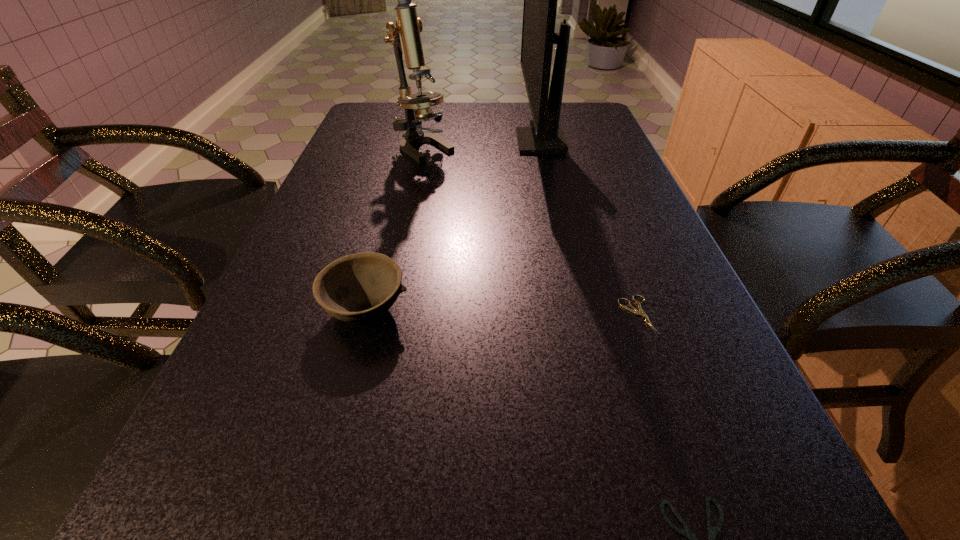
Where is `computer monitor`? computer monitor is located at coordinates (546, 136).

Where is `microscope`? microscope is located at coordinates (405, 37).

Locate an element on the screen. bowl is located at coordinates (356, 288).

Locate an element on the screen. the taller shears is located at coordinates (633, 310).

The width and height of the screenshot is (960, 540). I want to click on the farther shears, so click(633, 310).

Find the location of `free location located 0.180m on the front-facing side of the computer monitor`. free location located 0.180m on the front-facing side of the computer monitor is located at coordinates (454, 142).

This screenshot has width=960, height=540. Find the location of `blank area located on the front-facing side of the computer monitor`. blank area located on the front-facing side of the computer monitor is located at coordinates (454, 142).

Locate an element on the screen. The height and width of the screenshot is (540, 960). free location located on the front-facing side of the computer monitor is located at coordinates (479, 142).

Find the location of a particular element. vacant region located 0.070m on the front of the microscope is located at coordinates (420, 177).

What are the coordinates of `vacant region located 0.210m on the front of the bowl` in the screenshot? It's located at (323, 471).